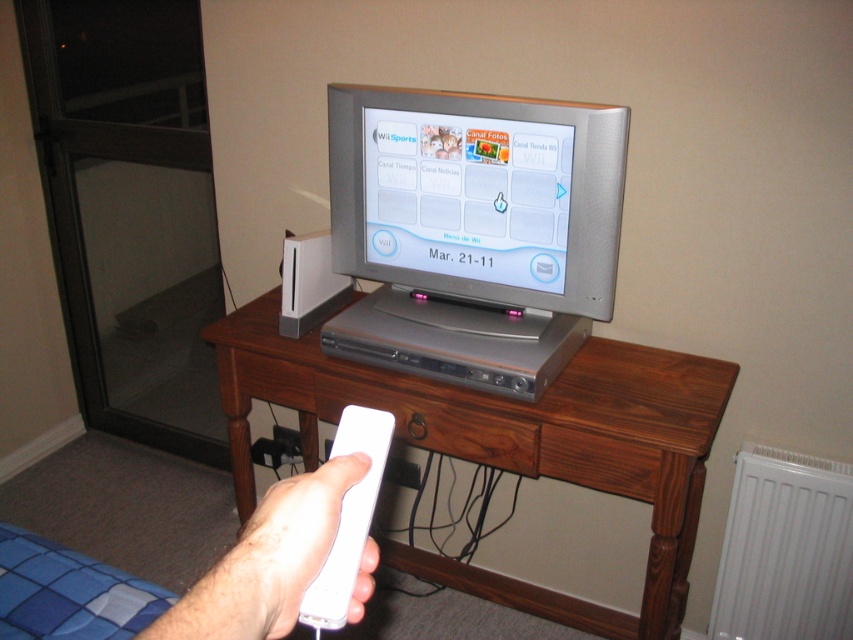
You are setting up a TV stand and need to place the white matte remote control at lower center and the white matte game controller at center. Given that the remote control is larger, which object should you place first to ensure both fit on the stand?

The white matte remote control at lower center is bigger than the white matte game controller at center, so you should place the white matte remote control at lower center first to ensure there is enough space for both.

You are playing a game and need to reach the white matte remote control at lower center to pause the game. The brown wood drawer at center has some snacks. Can you grab the snacks from the drawer without moving the remote?

The white matte remote control at lower center is in front of the brown wood drawer at center, so you can reach the snacks in the drawer without moving the remote since the drawer is behind the remote.

You are trying to locate the white matte game controller at center in the image. According to the scene, where is it placed in relation to the brown wood drawer at center?

The white matte game controller at center is placed above the brown wood drawer at center.